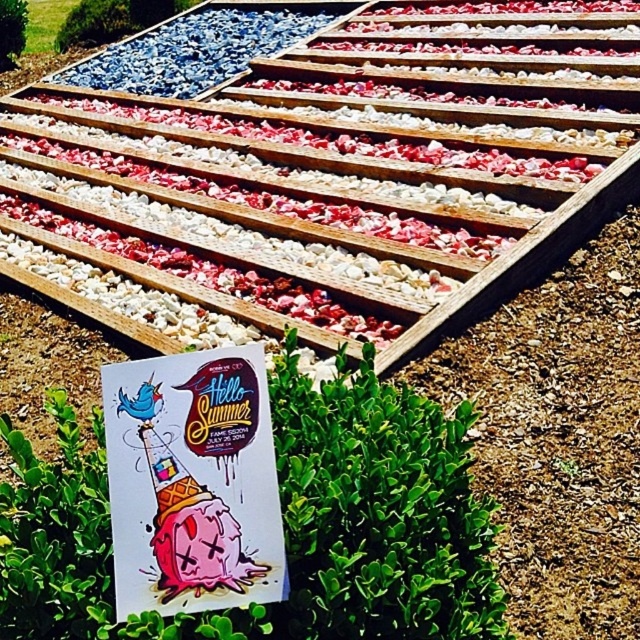
Question: Does green leafy bush at center appear under green leafy bush at upper left?

Choices:
 (A) yes
 (B) no

Answer: (A)

Question: Which point appears farthest from the camera in this image?

Choices:
 (A) (20, 38)
 (B) (483, 502)

Answer: (A)

Question: Does green leafy bush at center have a greater width compared to green leafy bush at upper left?

Choices:
 (A) yes
 (B) no

Answer: (A)

Question: Does green leafy bush at center have a greater width compared to green leafy bush at upper left?

Choices:
 (A) yes
 (B) no

Answer: (A)